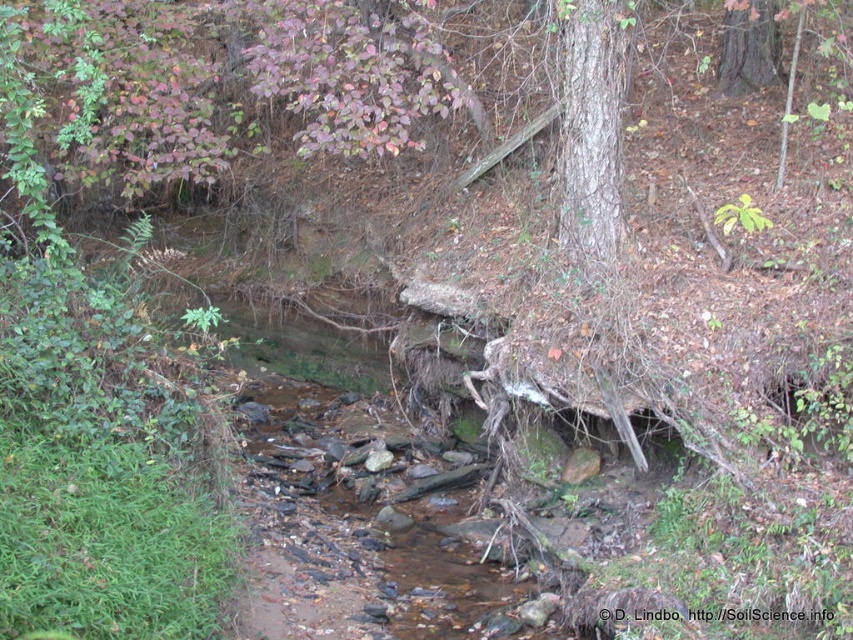
Question: Which point is closer to the camera taking this photo?

Choices:
 (A) (605, 250)
 (B) (734, 17)

Answer: (A)

Question: In this image, where is smooth bark tree at center located relative to smooth brown tree trunk at upper right?

Choices:
 (A) left
 (B) right

Answer: (A)

Question: Which of the following is the farthest from the observer?

Choices:
 (A) smooth brown tree trunk at upper right
 (B) smooth bark tree at center

Answer: (A)

Question: Can you confirm if smooth bark tree at center is bigger than smooth brown tree trunk at upper right?

Choices:
 (A) no
 (B) yes

Answer: (B)

Question: Can you confirm if smooth bark tree at center is positioned below smooth brown tree trunk at upper right?

Choices:
 (A) no
 (B) yes

Answer: (B)